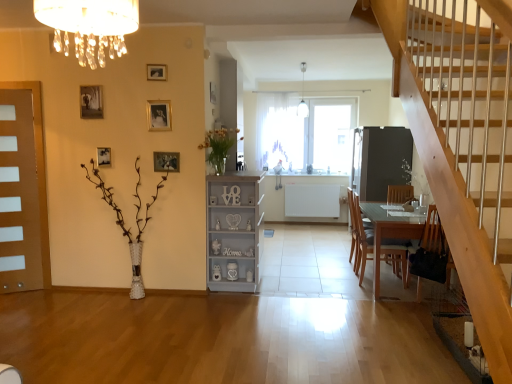
Find the location of a particular element. free space above matte brown door at left (from a real-world perspective) is located at coordinates (x=13, y=86).